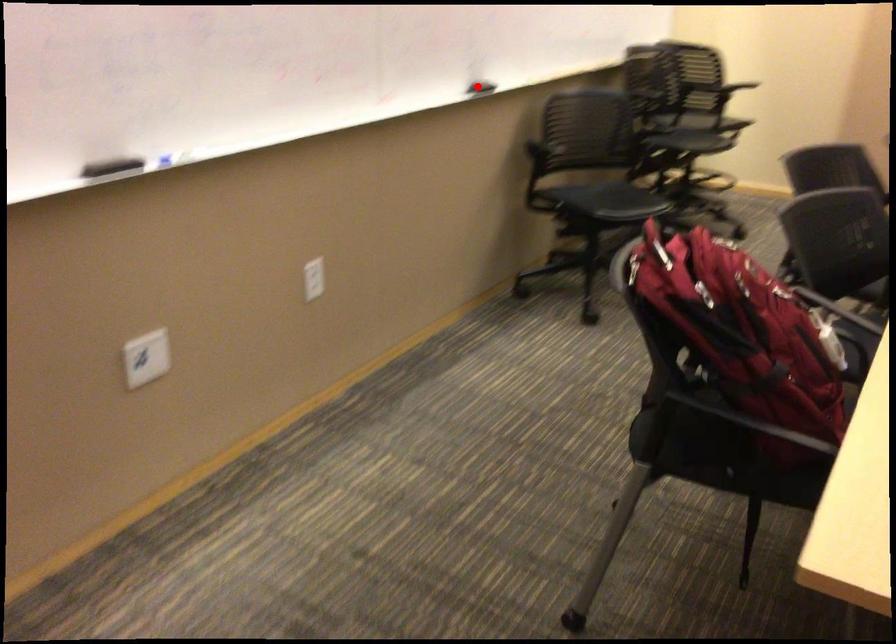
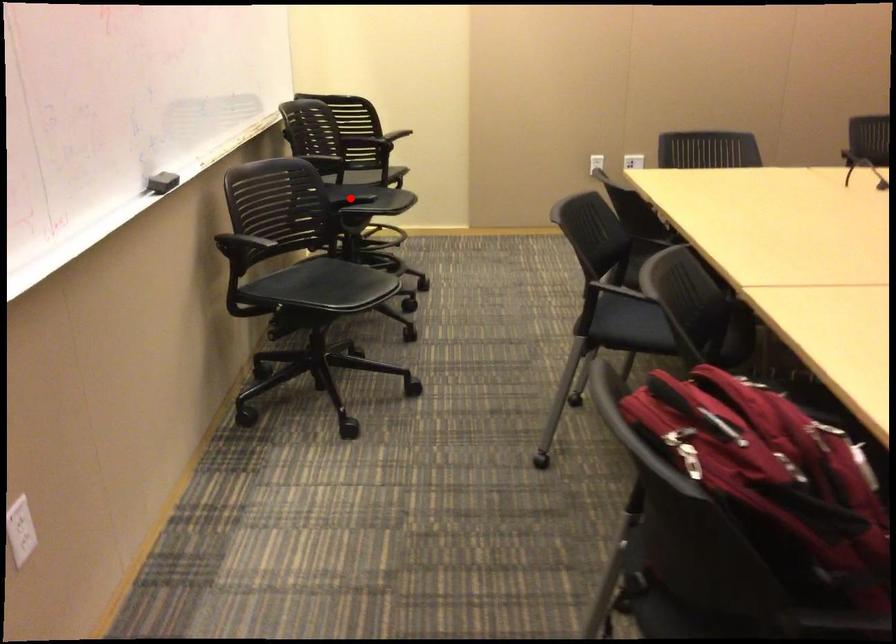
I am providing you with two images of the same scene from different viewpoints. A red point is marked on the first image and another point is marked on the second image. Is the red point in image1 aligned with the point shown in image2?

No